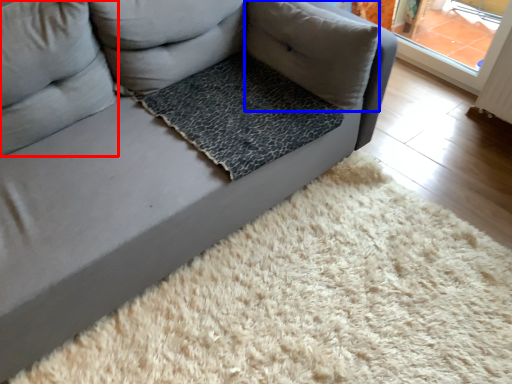
Question: Which of the following is the farthest to the observer, pillow (highlighted by a red box) or pillow (highlighted by a blue box)?

Choices:
 (A) pillow
 (B) pillow

Answer: (B)